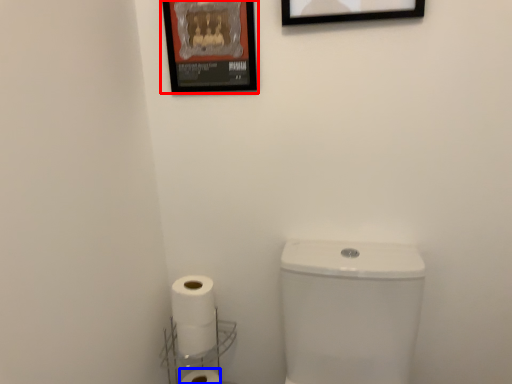
Question: Which object is further to the camera taking this photo, picture frame (highlighted by a red box) or toilet paper (highlighted by a blue box)?

Choices:
 (A) picture frame
 (B) toilet paper

Answer: (B)